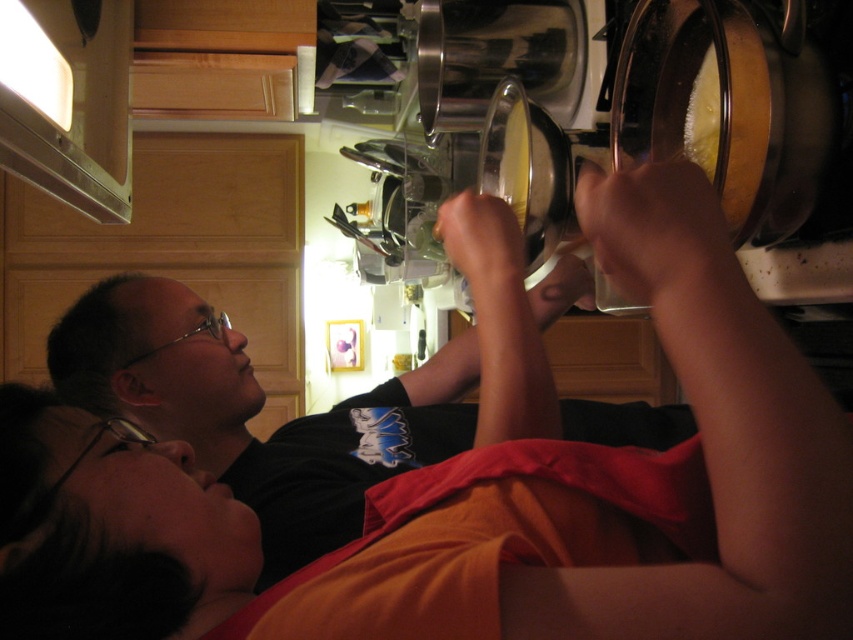
Is metallic silver exhaust hood at upper left thinner than yellow creamy food at upper right?

No.

Does metallic silver exhaust hood at upper left appear under yellow creamy food at upper right?

No.

Between point (85, 116) and point (718, 131), which one is positioned in front?

Point (718, 131) is more forward.

Where is `metallic silver exhaust hood at upper left`? The width and height of the screenshot is (853, 640). metallic silver exhaust hood at upper left is located at coordinates (68, 100).

Looking at this image, who is shorter, black matte shirt at upper left or metallic silver exhaust hood at upper left?

With less height is metallic silver exhaust hood at upper left.

Is black matte shirt at upper left shorter than metallic silver exhaust hood at upper left?

In fact, black matte shirt at upper left may be taller than metallic silver exhaust hood at upper left.

I want to click on black matte shirt at upper left, so click(x=334, y=406).

Can you confirm if black matte shirt at upper left is bigger than yellow creamy food at upper right?

Correct, black matte shirt at upper left is larger in size than yellow creamy food at upper right.

Is black matte shirt at upper left taller than yellow creamy food at upper right?

Yes, black matte shirt at upper left is taller than yellow creamy food at upper right.

Locate an element on the screen. black matte shirt at upper left is located at coordinates (334, 406).

Find the location of a particular element. The height and width of the screenshot is (640, 853). black matte shirt at upper left is located at coordinates (334, 406).